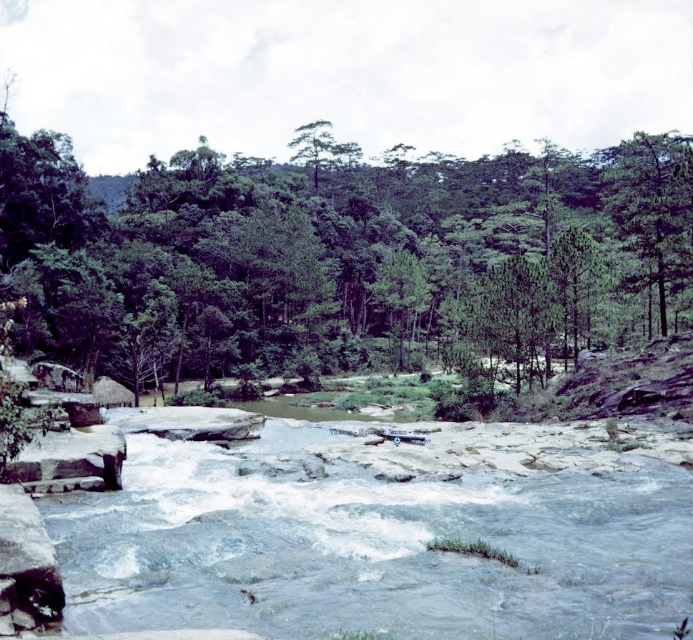
You are planning to take a photo of the green leafy forest at center and the green matte tree at upper right. Which one will appear closer to the camera in the photo?

The green leafy forest at center will appear closer to the camera because the green matte tree at upper right is behind it.